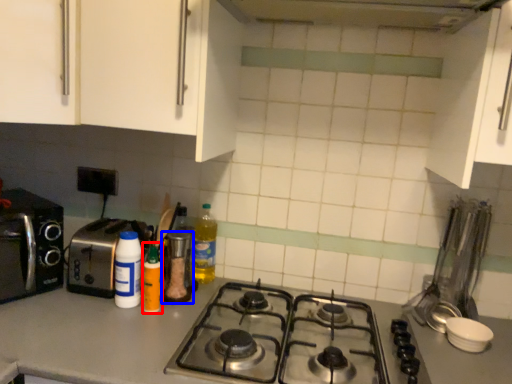
Question: Which point is further to the camera, bottle (highlighted by a red box) or kitchen appliance (highlighted by a blue box)?

Choices:
 (A) bottle
 (B) kitchen appliance

Answer: (B)